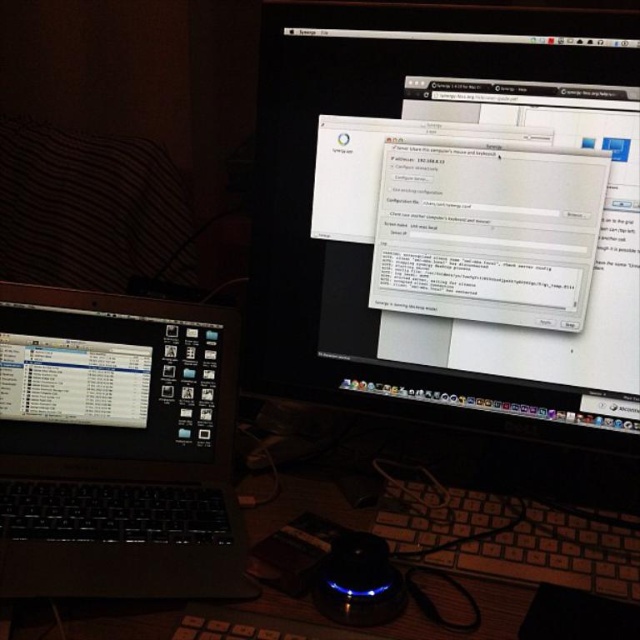
You are setting up a dual monitor workspace and need to place the satin black laptop at left and the black plastic keyboard at lower center. Based on their sizes, which object should be placed closer to the edge of the desk to prevent it from blocking the screen?

The satin black laptop at left is taller than the black plastic keyboard at lower center, so the laptop should be placed closer to the edge of the desk to prevent it from blocking the screen.

You are setting up a workstation and need to place a 7 inch wide cable between the satin black laptop at left and wooden at lower left. Is there enough space?

The distance between the satin black laptop at left and wooden at lower left is 6.58 inches, which is slightly less than the 7 inch width of the cable. Therefore, there isn not enough space to place the cable between them.

You are setting up a workspace and need to place a cup on the wooden at lower left without blocking the black plastic keyboard at lower center. Is this possible based on their positions?

The wooden at lower left is above the black plastic keyboard at lower center, so placing a cup on the wooden at lower left would not block the keyboard since it is positioned higher up.